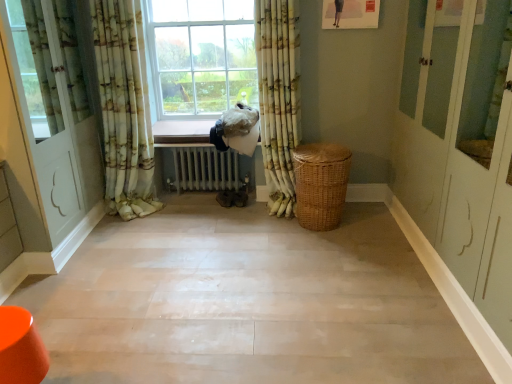
Locate an element on the screen. This screenshot has width=512, height=384. vacant space in front of floral fabric curtain at center, acting as the 2th curtain starting from the left is located at coordinates (266, 230).